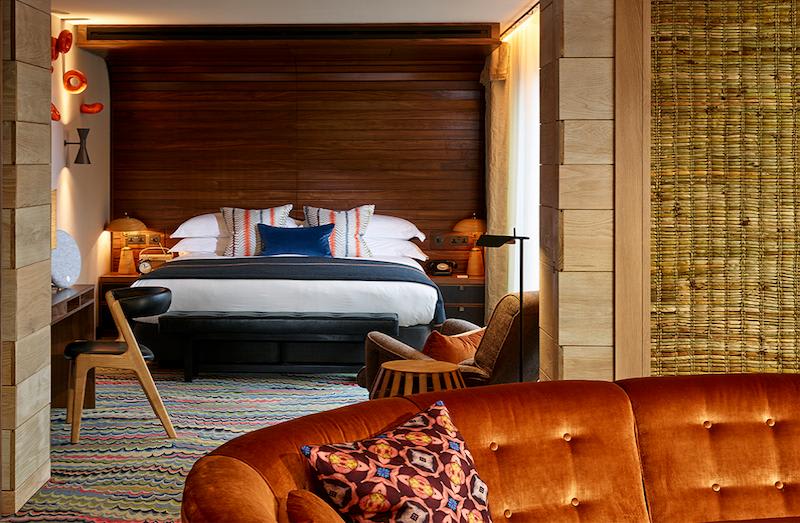
Where is `pillow`? Image resolution: width=800 pixels, height=523 pixels. pillow is located at coordinates (428, 480), (340, 238), (238, 233), (293, 245).